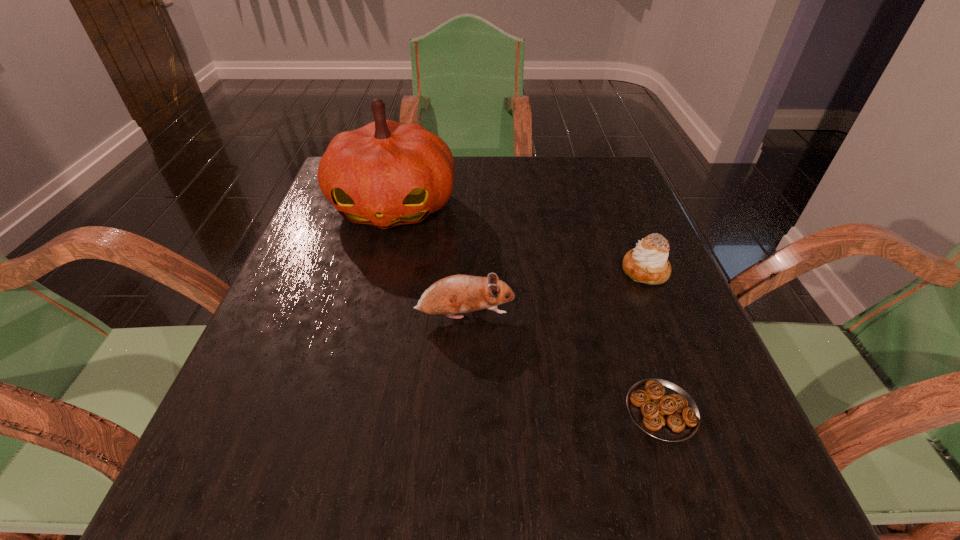
Image resolution: width=960 pixels, height=540 pixels. I want to click on free space located on the left of the nearest object, so click(x=579, y=410).

Where is `object that is at the far edge`? This screenshot has height=540, width=960. object that is at the far edge is located at coordinates (385, 174).

Find the location of `object positioned at the left edge`. object positioned at the left edge is located at coordinates (385, 174).

This screenshot has height=540, width=960. Find the location of `object that is at the far left corner`. object that is at the far left corner is located at coordinates (385, 174).

In order to click on free location at the far edge of the desktop in this screenshot , I will do `click(498, 180)`.

Locate an element on the screen. The height and width of the screenshot is (540, 960). vacant space at the near edge is located at coordinates (518, 488).

This screenshot has height=540, width=960. Find the location of `free space at the left edge of the desktop`. free space at the left edge of the desktop is located at coordinates (341, 261).

I want to click on vacant area at the right edge, so click(582, 239).

Find the location of a particular element. The height and width of the screenshot is (540, 960). empty location between the pumpkin and the third farthest object is located at coordinates (429, 261).

I want to click on free space between the hamster and the taller pastry, so click(555, 293).